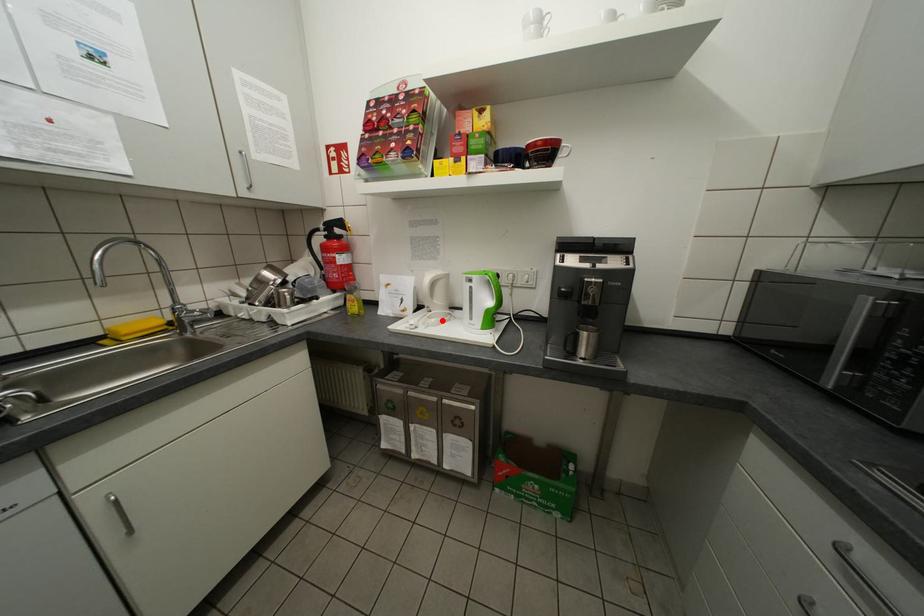
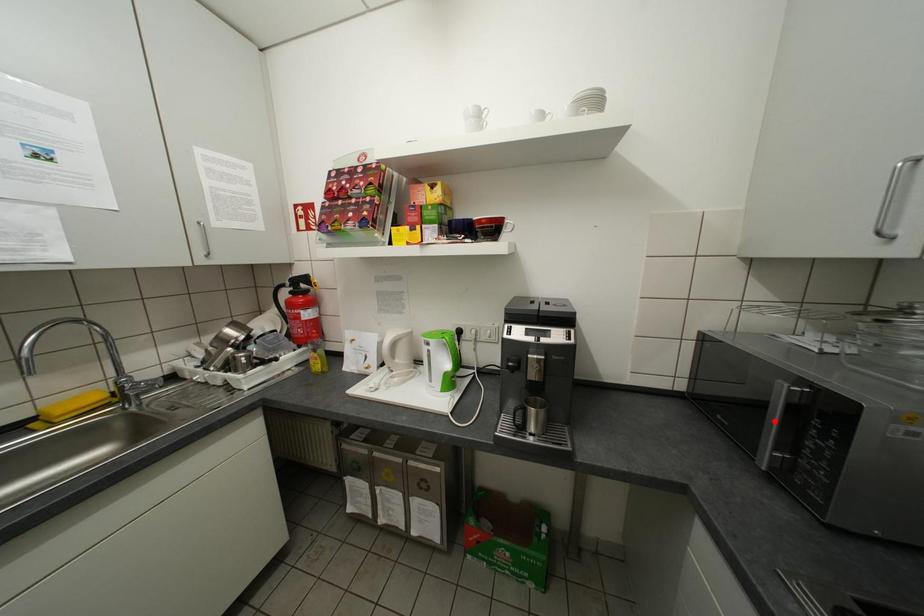
I am providing you with two images of the same scene from different viewpoints. A red point is marked on the first image and another point is marked on the second image. Do the highlighted points in image1 and image2 indicate the same real-world spot?

No